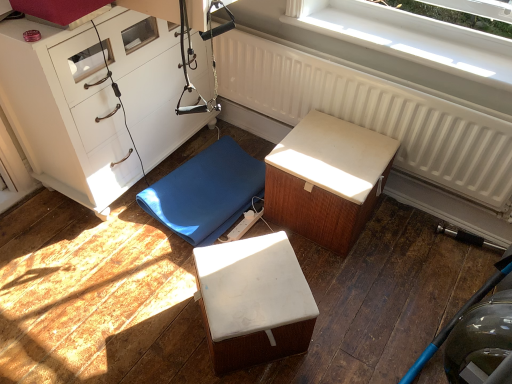
Locate an element on the screen. free space to the left of white matte cube at center, the 2th furniture in the right-to-left sequence is located at coordinates (157, 320).